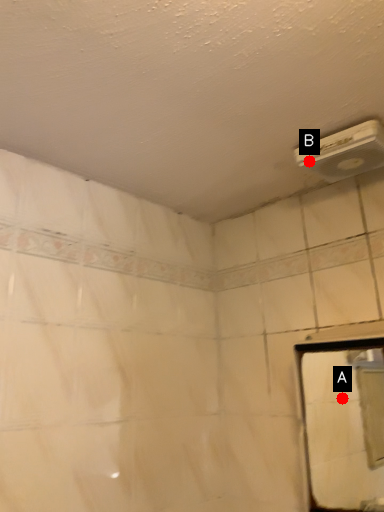
Question: Two points are circled on the image, labeled by A and B beside each circle. Which of the following is the closest to the observer?

Choices:
 (A) A is closer
 (B) B is closer

Answer: (B)